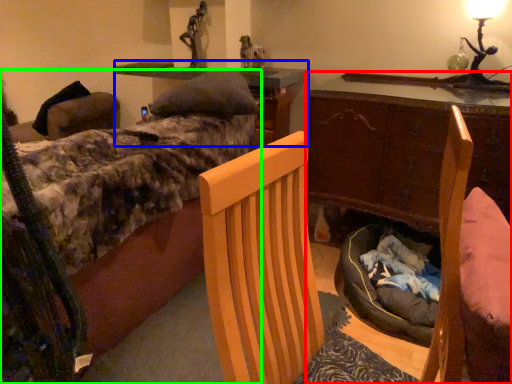
Question: Which object is positioned closest to desk (highlighted by a red box)? Select from computer desk (highlighted by a blue box) and bed (highlighted by a green box).

Choices:
 (A) computer desk
 (B) bed

Answer: (A)